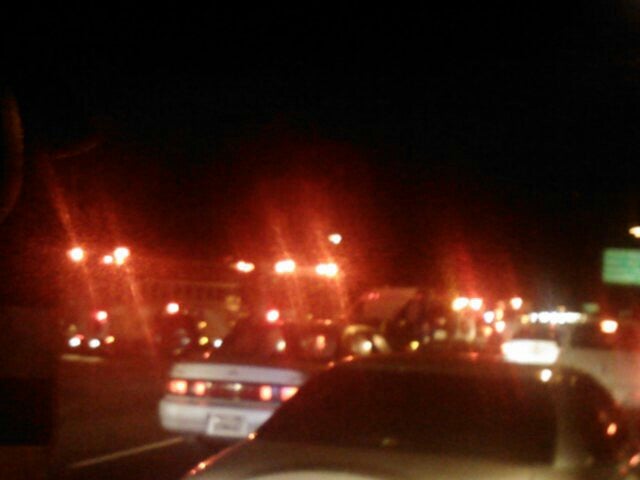
The width and height of the screenshot is (640, 480). I want to click on window, so click(406, 388).